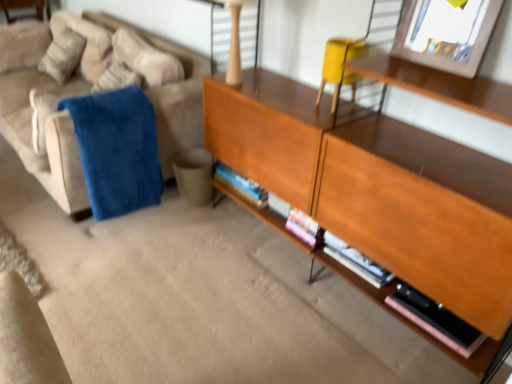
Find the location of a particular element. This screenshot has width=512, height=384. suede couch at left is located at coordinates (48, 131).

Describe the element at coordinates (436, 320) in the screenshot. The width and height of the screenshot is (512, 384). I see `pink matte book at lower right` at that location.

Identify the location of wooden picture frame at upper right. (446, 34).

The width and height of the screenshot is (512, 384). I want to click on suede couch at left, so click(x=48, y=131).

Is matte yellow swivel chair at upper right spatially inside matte beige table lamp at upper center, or outside of it?

matte yellow swivel chair at upper right is outside matte beige table lamp at upper center.

Does point (329, 55) appear closer or farther from the camera than point (223, 23)?

Point (329, 55) appears to be closer to the viewer than point (223, 23).

Considering the relative sizes of matte yellow swivel chair at upper right and matte beige table lamp at upper center in the image provided, is matte yellow swivel chair at upper right taller than matte beige table lamp at upper center?

Incorrect, the height of matte yellow swivel chair at upper right is not larger of that of matte beige table lamp at upper center.

Locate an element on the screen. This screenshot has width=512, height=384. table lamp above the matte yellow swivel chair at upper right (from the image's perspective) is located at coordinates (234, 37).

Considering the positions of objects blue plush blanket at left and wooden picture frame at upper right in the image provided, who is in front, blue plush blanket at left or wooden picture frame at upper right?

wooden picture frame at upper right is closer to the camera.

Considering the positions of point (101, 139) and point (462, 72), is point (101, 139) closer or farther from the camera than point (462, 72)?

Point (101, 139) is positioned farther from the camera compared to point (462, 72).

Is blue plush blanket at left taller or shorter than wooden picture frame at upper right?

Clearly, blue plush blanket at left is taller compared to wooden picture frame at upper right.

Which is more to the right, pink matte book at lower right or suede couch at left?

Positioned to the right is pink matte book at lower right.

Could you tell me if pink matte book at lower right is facing suede couch at left?

No, pink matte book at lower right is not aimed at suede couch at left.

Between pink matte book at lower right and suede couch at left, which one has less height?

pink matte book at lower right.

From the image's perspective, is pink matte book at lower right located above or below wooden cabinet at center?

pink matte book at lower right is situated lower than wooden cabinet at center in the image.

Choose the correct answer: Is pink matte book at lower right inside wooden cabinet at center or outside it?

pink matte book at lower right is contained in wooden cabinet at center.

From a real-world perspective, relative to wooden cabinet at center, is pink matte book at lower right vertically above or below?

In terms of real-world spatial position, pink matte book at lower right is below wooden cabinet at center.

Locate an element on the screen. The height and width of the screenshot is (384, 512). book behind the wooden cabinet at center is located at coordinates (436, 320).

Is wooden cabinet at center oriented away from matte yellow swivel chair at upper right?

Yes, wooden cabinet at center is facing away from matte yellow swivel chair at upper right.

Is matte yellow swivel chair at upper right a part of wooden cabinet at center?

Absolutely, matte yellow swivel chair at upper right is inside wooden cabinet at center.

Is matte beige table lamp at upper center positioned with its back to suede couch at left?

No.

Is matte beige table lamp at upper center inside or outside of suede couch at left?

matte beige table lamp at upper center is spatially situated outside suede couch at left.

Which object is closer to the camera taking this photo, matte beige table lamp at upper center or suede couch at left?

suede couch at left is closer to the camera.

Is matte beige table lamp at upper center directly adjacent to suede couch at left?

There is a gap between matte beige table lamp at upper center and suede couch at left.

Is point (337, 67) closer or farther from the camera than point (458, 38)?

Point (337, 67) is farther from the camera than point (458, 38).

Can you tell me how much matte yellow swivel chair at upper right and wooden picture frame at upper right differ in facing direction?

The angular difference between matte yellow swivel chair at upper right and wooden picture frame at upper right is 1 degrees.

Can you confirm if matte yellow swivel chair at upper right is thinner than wooden picture frame at upper right?

Incorrect, the width of matte yellow swivel chair at upper right is not less than that of wooden picture frame at upper right.

In the image, there is a matte yellow swivel chair at upper right. At what (x,y) coordinates should I click in order to perform the action: click on table lamp above it (from the image's perspective). Please return your answer as a coordinate pair (x, y). Looking at the image, I should click on 234,37.

The width and height of the screenshot is (512, 384). I want to click on picture frame on the right of blue plush blanket at left, so click(x=446, y=34).

Which object lies further to the anchor point pink matte book at lower right, suede couch at left or wooden picture frame at upper right?

suede couch at left is positioned further to the anchor pink matte book at lower right.

Based on their spatial positions, is blue plush blanket at left or suede couch at left further from wooden cabinet at center?

suede couch at left is positioned further to the anchor wooden cabinet at center.

From the image, which object appears to be farther from pink matte book at lower right, blue plush blanket at left or wooden cabinet at center?

blue plush blanket at left lies further to pink matte book at lower right than the other object.

Looking at the image, which one is located further to matte beige table lamp at upper center, pink matte book at lower right or blue plush blanket at left?

pink matte book at lower right.

Based on their spatial positions, is pink matte book at lower right or matte beige table lamp at upper center further from matte yellow swivel chair at upper right?

pink matte book at lower right is positioned further to the anchor matte yellow swivel chair at upper right.

When comparing their distances from matte beige table lamp at upper center, does matte yellow swivel chair at upper right or wooden cabinet at center seem further?

wooden cabinet at center is positioned further to the anchor matte beige table lamp at upper center.

Looking at this image, estimate the real-world distances between objects in this image. Which object is closer to matte yellow swivel chair at upper right, matte beige table lamp at upper center or blue plush blanket at left?

matte beige table lamp at upper center.

From the image, which object appears to be nearer to suede couch at left, matte beige table lamp at upper center or wooden cabinet at center?

matte beige table lamp at upper center.

Where is `blanket located between suede couch at left and matte beige table lamp at upper center in the left-right direction`? Image resolution: width=512 pixels, height=384 pixels. blanket located between suede couch at left and matte beige table lamp at upper center in the left-right direction is located at coordinates (117, 150).

The image size is (512, 384). I want to click on shelf located between suede couch at left and wooden picture frame at upper right in the left-right direction, so click(378, 192).

At what (x,y) coordinates should I click in order to perform the action: click on table lamp situated between suede couch at left and wooden picture frame at upper right from left to right. Please return your answer as a coordinate pair (x, y). Image resolution: width=512 pixels, height=384 pixels. Looking at the image, I should click on (234, 37).

The width and height of the screenshot is (512, 384). Identify the location of shelf that lies between matte yellow swivel chair at upper right and pink matte book at lower right from top to bottom. point(378,192).